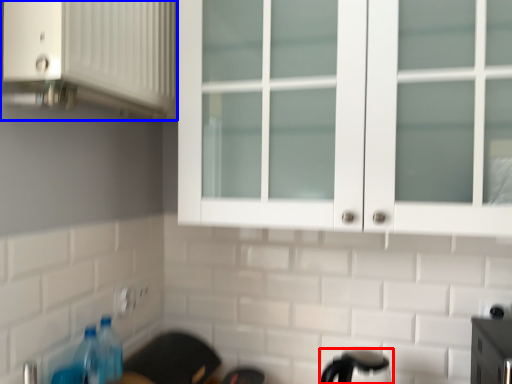
Question: Among these objects, which one is farthest to the camera, appliance (highlighted by a red box) or cabinetry (highlighted by a blue box)?

Choices:
 (A) appliance
 (B) cabinetry

Answer: (A)